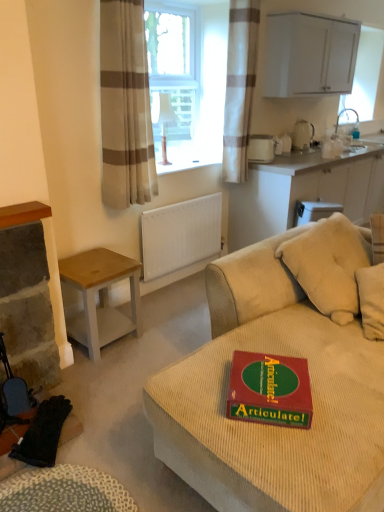
Locate an element on the screen. Image resolution: width=384 pixels, height=512 pixels. empty space that is ontop of light brown wood desk at left (from a real-world perspective) is located at coordinates (87, 263).